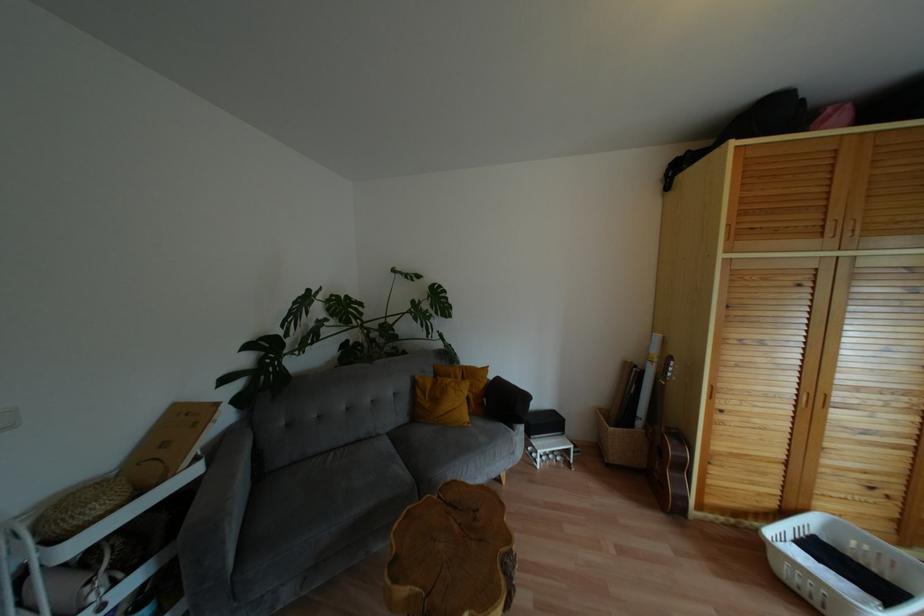
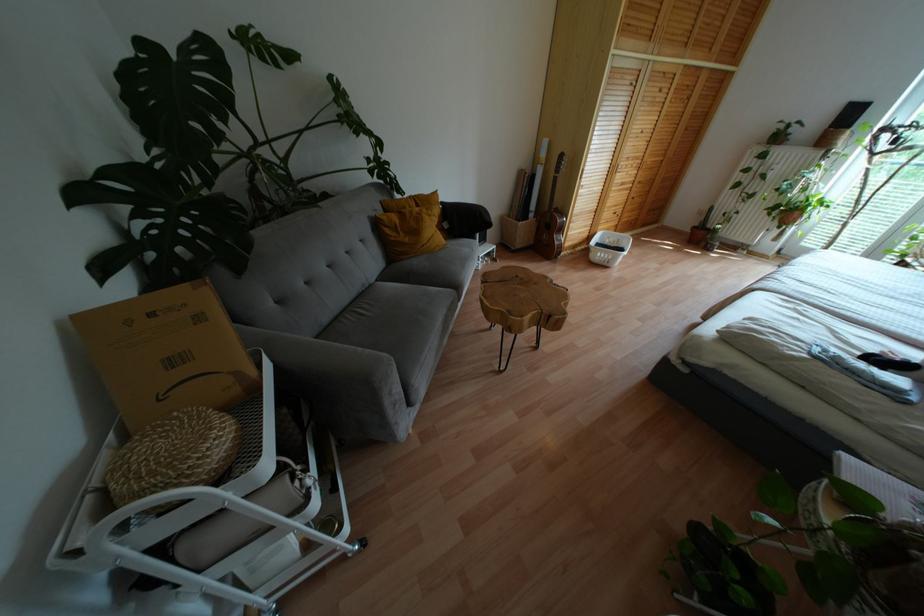
Where in the second image is the point corresponding to point 466,418 from the first image?

(443, 240)